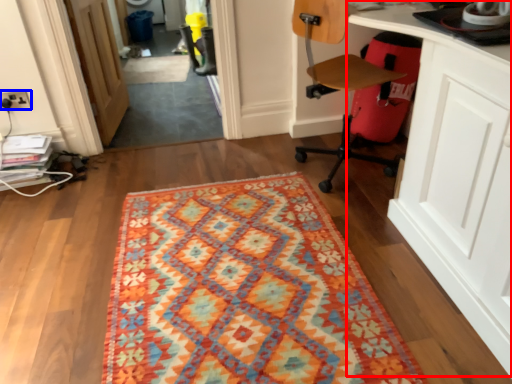
Question: Which of the following is the farthest to the observer, computer desk (highlighted by a red box) or electric outlet (highlighted by a blue box)?

Choices:
 (A) computer desk
 (B) electric outlet

Answer: (B)